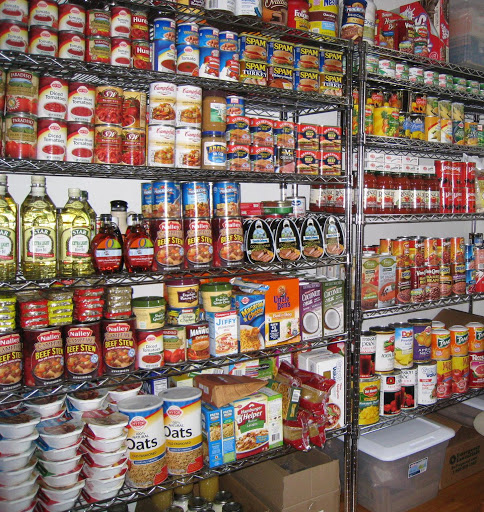
Where is `items on the floor under storage rack`? The height and width of the screenshot is (512, 484). items on the floor under storage rack is located at coordinates (422, 458), (318, 483), (208, 487), (230, 506), (224, 494), (197, 501), (176, 507), (183, 501), (169, 500).